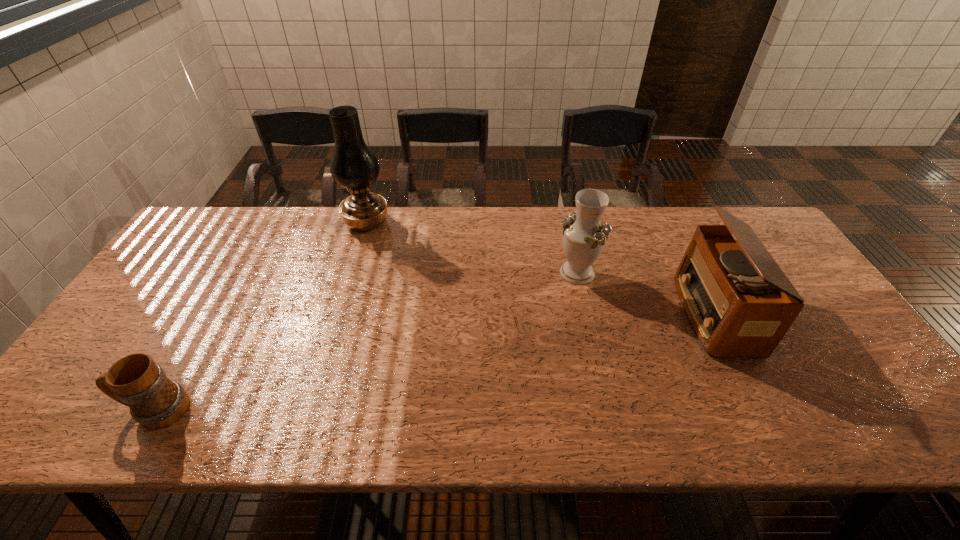
I want to click on free region at the far right corner of the desktop, so click(x=744, y=214).

Identify the location of free space that is in between the second object from right to left and the leftmost object. This screenshot has width=960, height=540. (367, 341).

The height and width of the screenshot is (540, 960). What are the coordinates of `vacant area that lies between the nearest object and the radio receiver` in the screenshot? It's located at (435, 362).

You are a GUI agent. You are given a task and a screenshot of the screen. Output one action in this format:
    pyautogui.click(x=<x>, y=<y>)
    Task: Click on the vacant space that's between the vase and the radio receiver
    The width and height of the screenshot is (960, 540).
    Given the screenshot: What is the action you would take?
    pyautogui.click(x=645, y=293)

Image resolution: width=960 pixels, height=540 pixels. I want to click on vacant region between the tallest object and the third object from left to right, so click(x=471, y=247).

The width and height of the screenshot is (960, 540). I want to click on free space between the third object from right to left and the shortest object, so click(x=261, y=316).

Where is `empty space that is in between the oil lamp and the mug`? empty space that is in between the oil lamp and the mug is located at coordinates (261, 316).

This screenshot has height=540, width=960. Identify the location of free space between the vase and the rightmost object. (645, 293).

Locate an element on the screen. The image size is (960, 540). vacant region between the leftmost object and the vase is located at coordinates (367, 341).

Find the location of a particular element. free area in between the tallest object and the radio receiver is located at coordinates (540, 268).